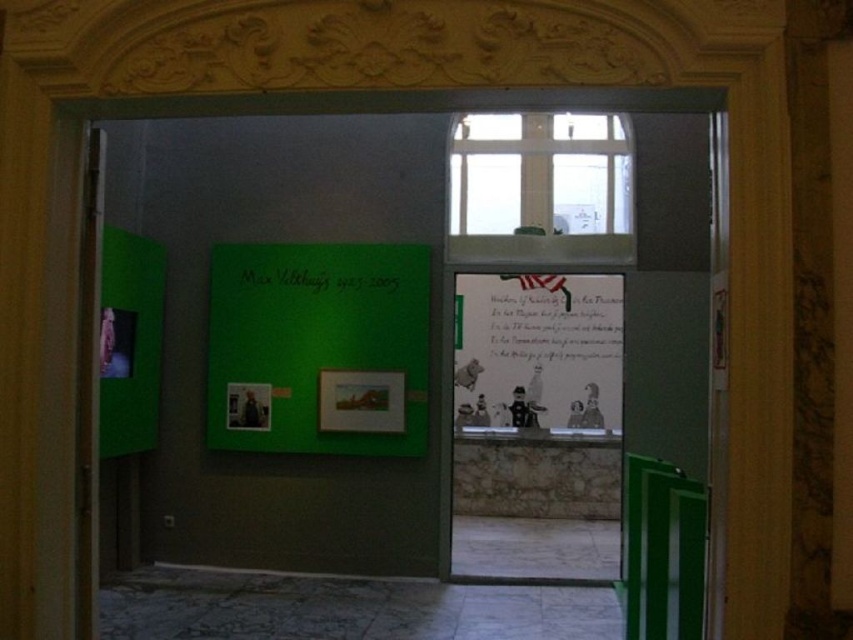
You are a visitor standing in the doorway of the exhibition room. You want to walk from the doorway to the matte paper poster at center and then to the green glossy door at right. Is the total distance you need to walk more than 5 meters?

The distance between the matte paper poster at center and the green glossy door at right is 5.01 meters. Since you start at the doorway, the total distance to walk to both would depend on your path. However, the direct distance between the two objects is just over 5 meters, so if you go from the doorway to the poster then to the door, assuming the doorway is near the poster, the total might exceed 5 meters. But without knowing the exact starting point relative to the poster, we can only confirm the distance

You are an art student entering the gallery and see the handwritten paper at center and the green matte sign at center. Which one is taller?

The handwritten paper at center is taller than the green matte sign at center.